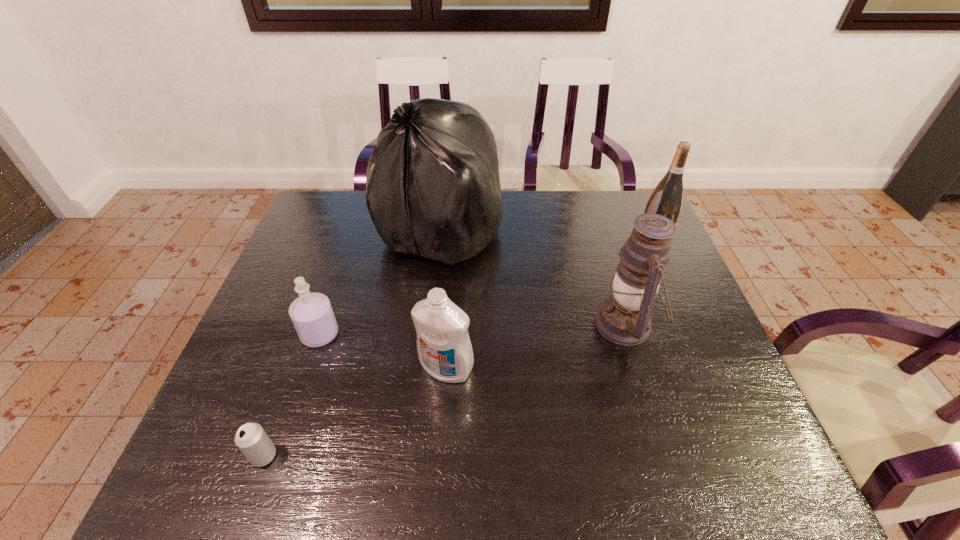
Find the location of a particular element. The height and width of the screenshot is (540, 960). wine bottle positioned at the right edge is located at coordinates (667, 198).

Identify the location of oil lamp that is at the right edge. Image resolution: width=960 pixels, height=540 pixels. (624, 318).

Where is `object present at the near left corner`? object present at the near left corner is located at coordinates (252, 440).

In order to click on object that is at the far right corner in this screenshot , I will do `click(667, 198)`.

I want to click on free space at the far edge, so click(603, 219).

Where is `vacant space at the near edge of the desktop`? vacant space at the near edge of the desktop is located at coordinates (631, 480).

The image size is (960, 540). What are the coordinates of `vacant region at the left edge of the desktop` in the screenshot? It's located at (282, 420).

At what (x,y) coordinates should I click in order to perform the action: click on free space at the right edge of the desktop. Please return your answer as a coordinate pair (x, y). Looking at the image, I should click on (659, 298).

In the image, there is a desktop. Identify the location of free space at the near left corner. The image size is (960, 540). (218, 451).

Locate an element on the screen. This screenshot has width=960, height=540. free space between the nearest object and the fourth tallest object is located at coordinates (355, 412).